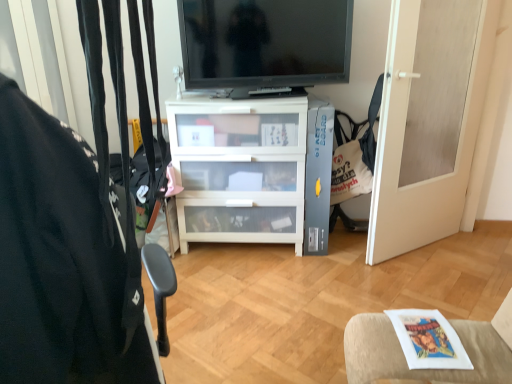
This screenshot has height=384, width=512. Find the location of `black fabric chair at left`. black fabric chair at left is located at coordinates (61, 261).

Identify the location of white fabric bag at right. The image size is (512, 384). (349, 162).

Who is bigger, white matte door at right or white fabric cushion at lower right?

white matte door at right is bigger.

In the image, is white matte door at right positioned in front of or behind white fabric cushion at lower right?

white matte door at right is behind white fabric cushion at lower right.

Considering the sizes of objects white matte door at right and white fabric cushion at lower right in the image provided, who is shorter, white matte door at right or white fabric cushion at lower right?

white fabric cushion at lower right.

Looking at their sizes, would you say white matte door at right is wider or thinner than white fabric cushion at lower right?

Considering their sizes, white matte door at right looks slimmer than white fabric cushion at lower right.

Considering the sizes of white fabric cushion at lower right and black fabric chair at left in the image, is white fabric cushion at lower right taller or shorter than black fabric chair at left?

Clearly, white fabric cushion at lower right is shorter compared to black fabric chair at left.

From a real-world perspective, is white fabric cushion at lower right located higher than black fabric chair at left?

No, from a real-world perspective, white fabric cushion at lower right is not on top of black fabric chair at left.

Does point (355, 318) lie in front of point (118, 287)?

No, it is not.

From a real-world perspective, which is physically below, white fabric cushion at lower right or white fabric bag at right?

From a 3D spatial view, white fabric cushion at lower right is below.

Is white fabric cushion at lower right next to white fabric bag at right?

No.

Locate an element on the screen. Image resolution: width=512 pixels, height=384 pixels. chair located on the left of white fabric bag at right is located at coordinates click(x=429, y=369).

From the image's perspective, is white fabric cushion at lower right over white fabric bag at right?

No.

You are a GUI agent. You are given a task and a screenshot of the screen. Output one action in this format:
    pyautogui.click(x=<x>, y=<y>)
    Task: Click on the television to the left of white matte door at right
    
    Given the screenshot: What is the action you would take?
    pyautogui.click(x=265, y=43)

In the scene shown: Does black glossy tv at upper center come in front of white matte door at right?

No, it is not.

From a real-world perspective, is black glossy tv at upper center under white matte door at right?

No, from a real-world perspective, black glossy tv at upper center is not beneath white matte door at right.

Considering the relative positions of black glossy tv at upper center and white matte door at right in the image provided, is black glossy tv at upper center to the right of white matte door at right from the viewer's perspective?

Incorrect, black glossy tv at upper center is not on the right side of white matte door at right.

From a real-world perspective, which is physically below, white matte door at right or black fabric chair at left?

white matte door at right.

From the image's perspective, is white matte door at right under black fabric chair at left?

Actually, white matte door at right appears above black fabric chair at left in the image.

Considering the sizes of objects white matte door at right and black fabric chair at left in the image provided, who is wider, white matte door at right or black fabric chair at left?

With larger width is white matte door at right.

From the image's perspective, is white fabric cushion at lower right under white matte door at right?

Yes, from the image's perspective, white fabric cushion at lower right is beneath white matte door at right.

Can you see white fabric cushion at lower right touching white matte door at right?

No, white fabric cushion at lower right is not in contact with white matte door at right.

From a real-world perspective, who is located higher, white fabric cushion at lower right or white matte door at right?

white matte door at right.

Which is behind, point (366, 188) or point (4, 312)?

The point (366, 188) is behind.

What's the angular difference between white fabric bag at right and black fabric chair at left's facing directions?

They differ by 91.1 degrees in their facing directions.

Based on the photo, does white fabric bag at right have a larger size compared to black fabric chair at left?

Incorrect, white fabric bag at right is not larger than black fabric chair at left.

From the image's perspective, is white fabric bag at right below black fabric chair at left?

No.

What are the coordinates of `chair on the left of white matte door at right` in the screenshot? It's located at (429, 369).

You are a GUI agent. You are given a task and a screenshot of the screen. Output one action in this format:
    pyautogui.click(x=<x>, y=<y>)
    Task: Click on the furniture above the white fabric cushion at lower right (from the image's perspective)
    Image resolution: width=512 pixels, height=384 pixels.
    Given the screenshot: What is the action you would take?
    pyautogui.click(x=61, y=261)

From the image, which object appears to be farther from black fabric chair at left, white matte door at right or white fabric cushion at lower right?

white matte door at right is positioned further to the anchor black fabric chair at left.

Looking at the image, which one is located closer to black fabric chair at left, white matte door at right or black glossy tv at upper center?

The object closer to black fabric chair at left is black glossy tv at upper center.

When comparing their distances from black fabric chair at left, does white fabric cushion at lower right or white matte door at right seem closer?

white fabric cushion at lower right lies closer to black fabric chair at left than the other object.

When comparing their distances from black glossy tv at upper center, does white matte door at right or black fabric chair at left seem further?

black fabric chair at left.

Looking at the image, which one is located further to white fabric bag at right, black fabric chair at left or black glossy tv at upper center?

Based on the image, black fabric chair at left appears to be further to white fabric bag at right.

Which object lies nearer to the anchor point black glossy tv at upper center, white fabric cushion at lower right or white fabric bag at right?

Based on the image, white fabric bag at right appears to be nearer to black glossy tv at upper center.

From the image, which object appears to be farther from white fabric bag at right, black fabric chair at left or white matte door at right?

Based on the image, black fabric chair at left appears to be further to white fabric bag at right.

Considering their positions, is white fabric cushion at lower right positioned further to white fabric bag at right than black fabric chair at left?

Among the two, black fabric chair at left is located further to white fabric bag at right.

Where is `chair between black fabric chair at left and white matte door at right from front to back`? The image size is (512, 384). chair between black fabric chair at left and white matte door at right from front to back is located at coordinates (429, 369).

The image size is (512, 384). Find the location of `door between black fabric chair at left and white fabric bag at right in the front-back direction`. door between black fabric chair at left and white fabric bag at right in the front-back direction is located at coordinates (429, 120).

You are a GUI agent. You are given a task and a screenshot of the screen. Output one action in this format:
    pyautogui.click(x=<x>, y=<y>)
    Task: Click on the door between white fabric cushion at lower right and white fabric bag at right in the front-back direction
    This screenshot has height=384, width=512.
    Given the screenshot: What is the action you would take?
    pyautogui.click(x=429, y=120)

The height and width of the screenshot is (384, 512). In order to click on chair located between black fabric chair at left and white fabric bag at right in the depth direction in this screenshot , I will do `click(429, 369)`.